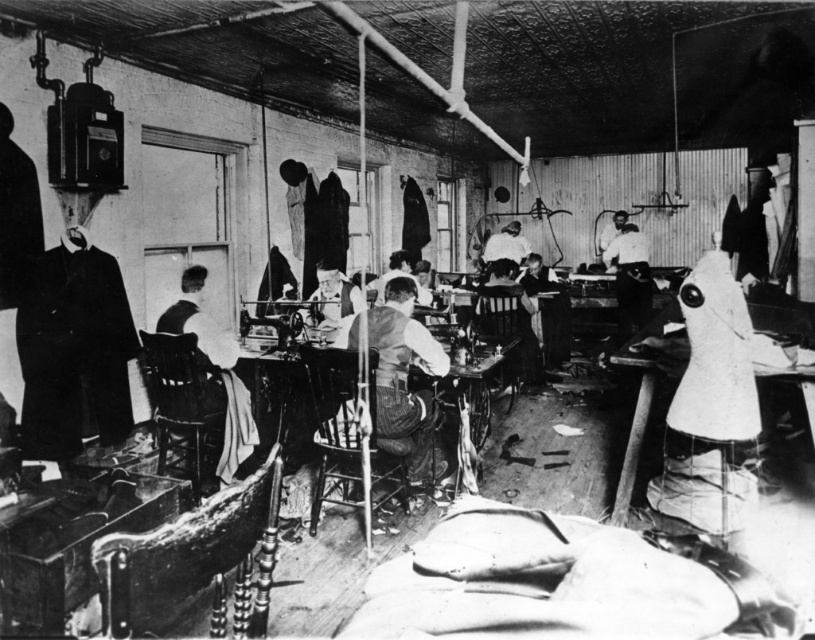
You are a tailor in the workshop and need to determine which garment takes up more space on your worktable. Which one is larger between the matte black vest at center and the white fabric shirt at upper center?

The matte black vest at center is larger in size than the white fabric shirt at upper center, so the matte black vest at center takes up more space on the worktable.

You are a photographer standing near the camera in a vintage sewing workshop. You want to capture a closeup shot of the white fabric shirt at upper center. Given that your camera has a maximum focus range of 30 feet, will you be able to focus on the shirt without moving closer?

The white fabric shirt at upper center and camera are 30.70 feet apart from each other. Since the maximum focus range is 30 feet, the distance is slightly beyond the camera can focus. Therefore, you need to move closer to ensure proper focus.